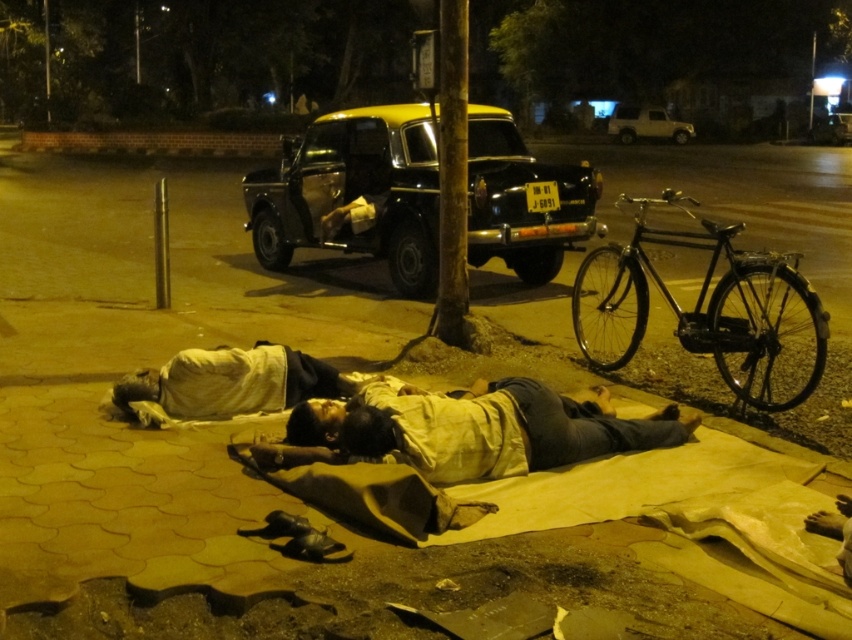
Question: Can you confirm if yellow painted metal taxi at center is positioned below metallic gold car at upper right?

Choices:
 (A) no
 (B) yes

Answer: (B)

Question: Which of the following is the closest to the observer?

Choices:
 (A) yellow painted metal taxi at center
 (B) metallic gold car at upper right

Answer: (A)

Question: Among these objects, which one is nearest to the camera?

Choices:
 (A) light beige fabric at lower center
 (B) metallic gold car at upper right

Answer: (A)

Question: Does light beige fabric at lower center have a larger size compared to metallic gold car at upper right?

Choices:
 (A) no
 (B) yes

Answer: (A)

Question: Which object is positioned closest to the light beige fabric at lower center?

Choices:
 (A) metallic gold car at upper right
 (B) yellow painted metal taxi at center

Answer: (B)

Question: Does yellow painted metal taxi at center come in front of light beige fabric at lower center?

Choices:
 (A) yes
 (B) no

Answer: (B)